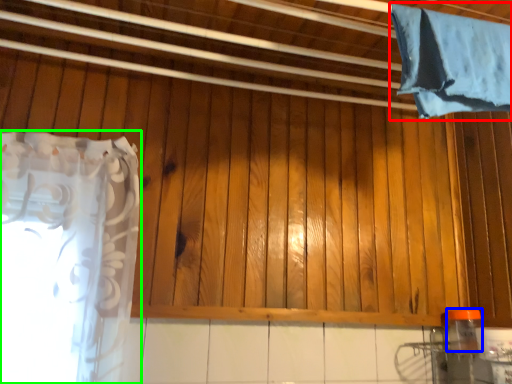
Question: Which object is positioned farthest from curtain (highlighted by a red box)? Select from bottle (highlighted by a blue box) and curtain (highlighted by a green box).

Choices:
 (A) bottle
 (B) curtain

Answer: (B)